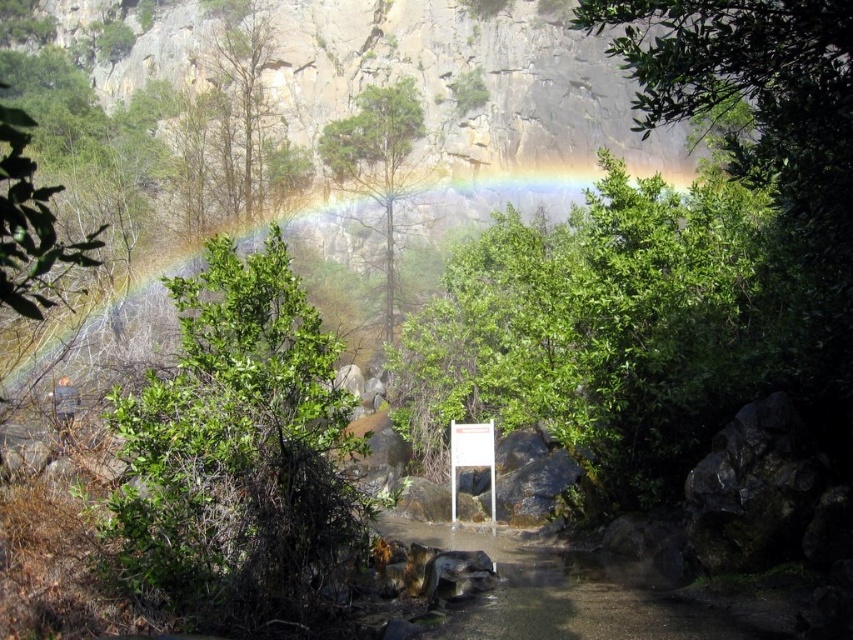
Does green leafy bush at left lie behind rainbow at upper center?

No, it is in front of rainbow at upper center.

Is point (213, 332) less distant than point (41, 392)?

Yes.

What do you see at coordinates (241, 458) in the screenshot? The height and width of the screenshot is (640, 853). I see `green leafy bush at left` at bounding box center [241, 458].

The height and width of the screenshot is (640, 853). In order to click on green leafy bush at left in this screenshot , I will do `click(241, 458)`.

In the scene shown: Between rainbow at upper center and white paper at center, which one appears on the right side from the viewer's perspective?

From the viewer's perspective, white paper at center appears more on the right side.

Does point (161, 344) lie in front of point (491, 490)?

No, (161, 344) is further to viewer.

Image resolution: width=853 pixels, height=640 pixels. Find the location of `rainbow at upper center`. rainbow at upper center is located at coordinates (103, 346).

Where is `rainbow at upper center`? This screenshot has height=640, width=853. rainbow at upper center is located at coordinates (103, 346).

Is green matte tree at center positioned in front of white paper at center?

That is False.

Is point (393, 88) less distant than point (480, 451)?

No.

I want to click on green matte tree at center, so tap(376, 157).